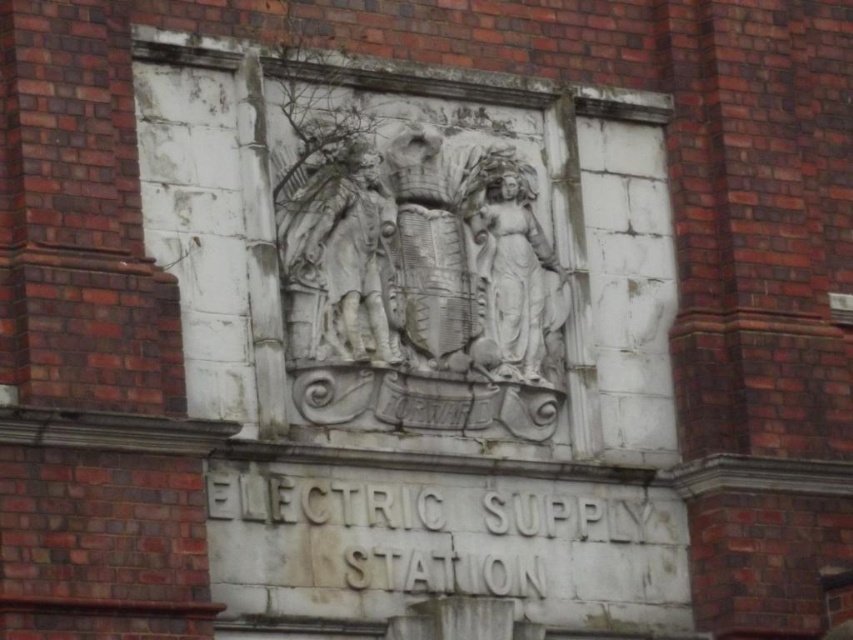
Question: Is white stone relief at center smaller than white stone statue at center?

Choices:
 (A) yes
 (B) no

Answer: (B)

Question: Among these points, which one is nearest to the camera?

Choices:
 (A) (532, 276)
 (B) (343, 314)

Answer: (B)

Question: Is white stone relief at center thinner than white stone statue at center?

Choices:
 (A) yes
 (B) no

Answer: (A)

Question: From the image, what is the correct spatial relationship of white stone relief at center in relation to white stone statue at center?

Choices:
 (A) above
 (B) below

Answer: (B)

Question: Among these objects, which one is nearest to the camera?

Choices:
 (A) white stone relief at center
 (B) white stone statue at center

Answer: (A)